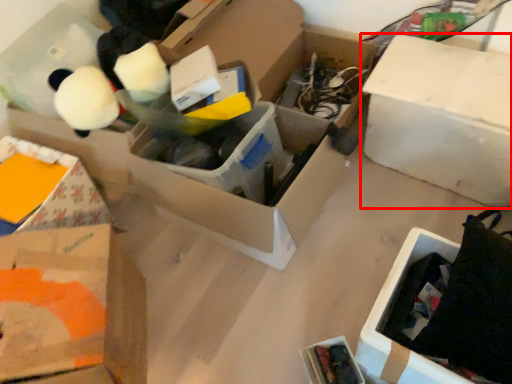
Question: From the image's perspective, where is box (annotated by the red box) located relative to cardboard box?

Choices:
 (A) below
 (B) above

Answer: (B)